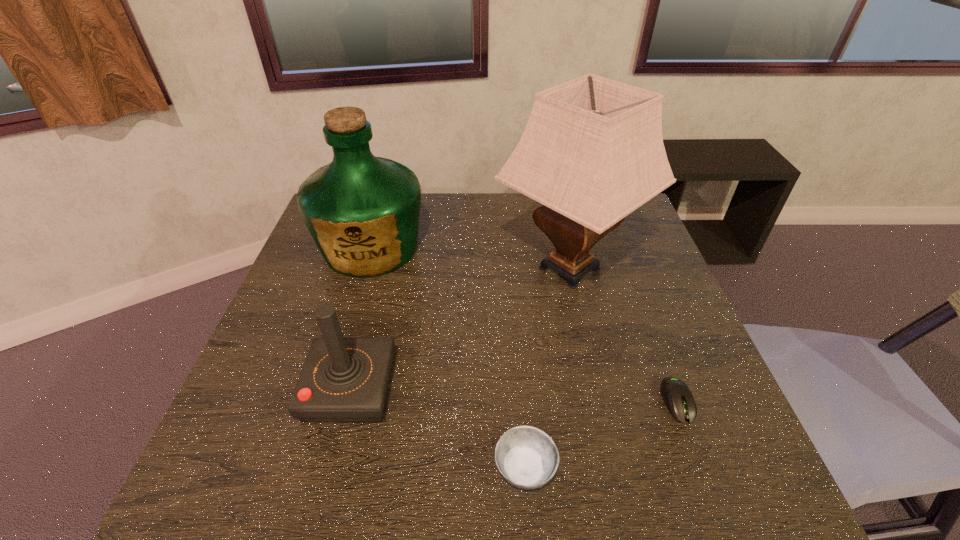
Identify the location of lampshade. (592, 152).

Identify the location of liquor. (362, 211).

In order to click on the third tallest object in this screenshot , I will do `click(343, 379)`.

The height and width of the screenshot is (540, 960). What are the coordinates of `the second shortest object` in the screenshot? It's located at (526, 457).

The image size is (960, 540). Identify the location of ashtray. (526, 457).

Find the location of a particular element. This screenshot has height=540, width=960. the shortest object is located at coordinates (676, 395).

The height and width of the screenshot is (540, 960). In order to click on free space located 0.140m on the front of the tallest object in this screenshot , I will do `click(594, 375)`.

The width and height of the screenshot is (960, 540). I want to click on vacant region located on the label side of the liquor, so click(x=321, y=421).

Locate an element on the screen. The height and width of the screenshot is (540, 960). vacant space situated 0.090m on the rectangular base of the joystick is located at coordinates (434, 389).

Find the location of `free space located 0.370m on the left of the ashtray`. free space located 0.370m on the left of the ashtray is located at coordinates (290, 468).